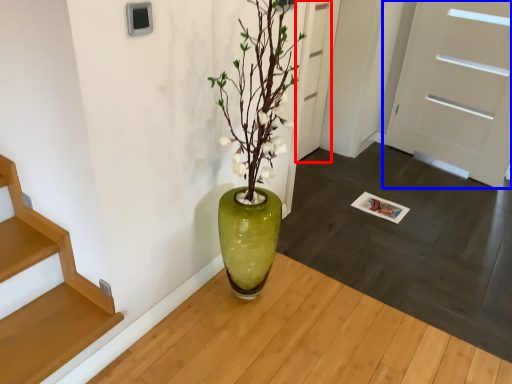
Question: Which object is further to the camera taking this photo, door (highlighted by a red box) or door (highlighted by a blue box)?

Choices:
 (A) door
 (B) door

Answer: (A)